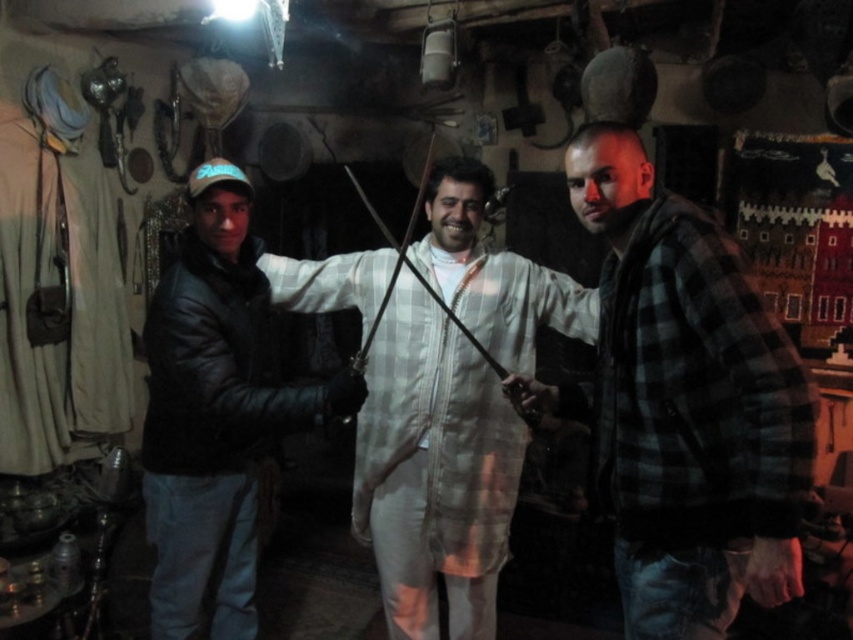
You are standing in the shop and want to take a photo of the point at coordinates point (753, 337). If your camera has a focal length of 50mm and you want to ensure the subject is in focus, what is the minimum distance you should be from the point?

The point (753, 337) is 1.48 meters away from the camera, so you should position yourself at least 1.48 meters away to ensure the subject is in focus.

You are a photographer setting up a shoot in this traditional shop. You need to decide where to place a large backdrop that must be behind both the white checkered robe at center and the black leather jacket at left. Given their sizes, which object should the backdrop be positioned relative to ensure it covers both adequately?

The white checkered robe at center is bigger than the black leather jacket at left, so the backdrop should be placed behind the white checkered robe at center to ensure it covers both objects adequately.

You are taking a photo of two points in a shop. The first point is at position point (752, 355) and the second point is at point (723, 243). Which point is closer to your camera?

Point (752, 355) is closer to the camera than point (723, 243).